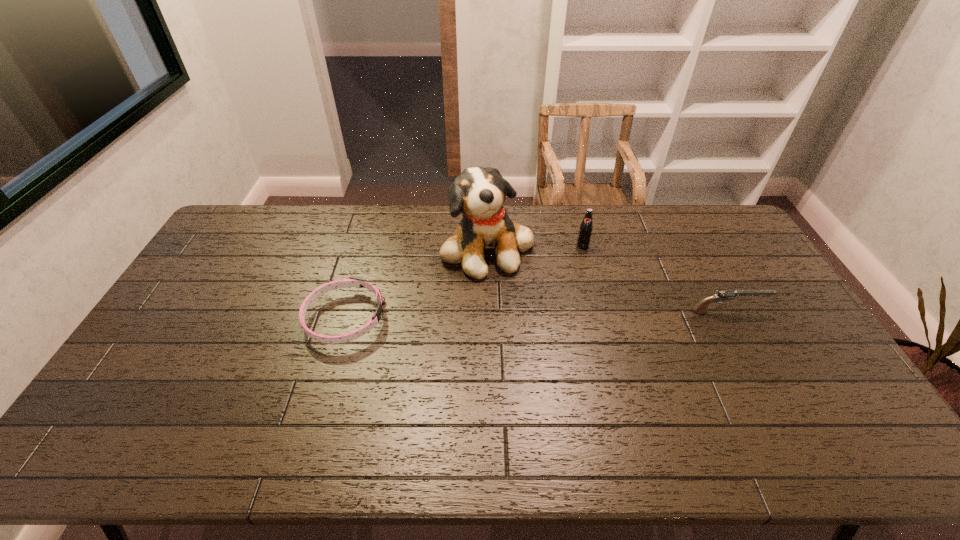
You are a GUI agent. You are given a task and a screenshot of the screen. Output one action in this format:
    pyautogui.click(x=<x>, y=<y>)
    Task: Click on the shortest object
    This screenshot has width=960, height=540.
    Given the screenshot: What is the action you would take?
    pyautogui.click(x=353, y=281)

Where is `the leftmost object`? The image size is (960, 540). the leftmost object is located at coordinates (353, 281).

Image resolution: width=960 pixels, height=540 pixels. I want to click on gun, so click(724, 295).

Image resolution: width=960 pixels, height=540 pixels. In order to click on the rightmost object in this screenshot , I will do `click(724, 295)`.

The width and height of the screenshot is (960, 540). Find the location of `pop`. pop is located at coordinates (585, 230).

Locate an element on the screen. This screenshot has height=540, width=960. the third object from left to right is located at coordinates (585, 230).

Image resolution: width=960 pixels, height=540 pixels. What are the coordinates of `the third object from right to left` in the screenshot? It's located at (478, 193).

You are a GUI agent. You are given a task and a screenshot of the screen. Output one action in this format:
    pyautogui.click(x=<x>, y=<y>)
    Task: Click on the tallest object
    
    Given the screenshot: What is the action you would take?
    pyautogui.click(x=478, y=193)

At what (x,y) coordinates should I click in order to perform the action: click on free space located with the buckle on the dog collar. Please return your answer as a coordinate pair (x, y). Image resolution: width=960 pixels, height=540 pixels. Looking at the image, I should click on (509, 318).

Locate an element on the screen. Image resolution: width=960 pixels, height=540 pixels. free point located aiming along the barrel of the rightmost object is located at coordinates (792, 311).